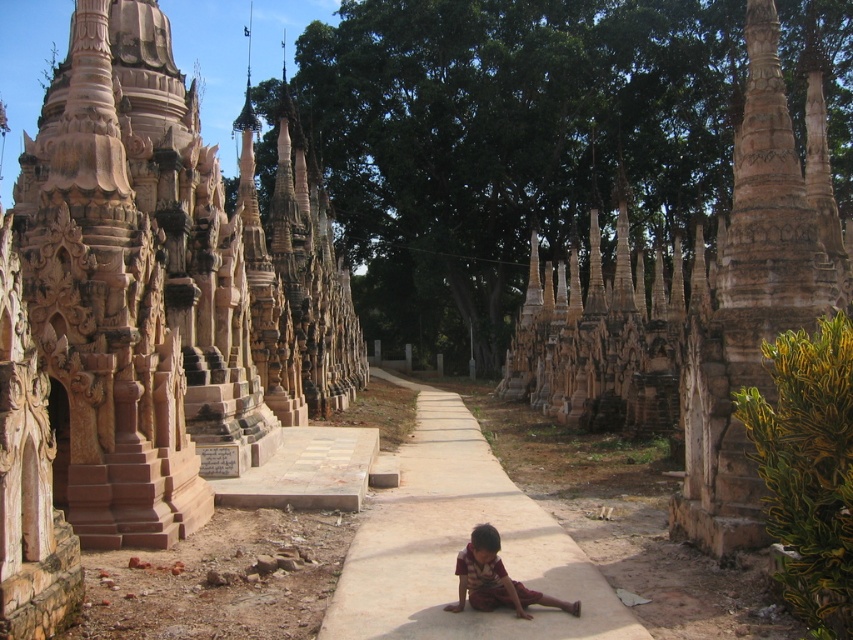
Is brown stone temple at center shorter than sandy concrete path at center?

No, brown stone temple at center is not shorter than sandy concrete path at center.

Who is shorter, brown stone temple at center or sandy concrete path at center?

Standing shorter between the two is sandy concrete path at center.

Between point (94, 195) and point (347, 577), which one is positioned in front?

Positioned in front is point (347, 577).

Image resolution: width=853 pixels, height=640 pixels. Find the location of `brown stone temple at center`. brown stone temple at center is located at coordinates (146, 314).

Between smooth stone pillar at center and sandy concrete path at center, which one appears on the left side from the viewer's perspective?

From the viewer's perspective, sandy concrete path at center appears more on the left side.

Which is above, smooth stone pillar at center or sandy concrete path at center?

smooth stone pillar at center is above.

Is point (689, 362) behind point (451, 508)?

No, it is not.

Locate an element on the screen. smooth stone pillar at center is located at coordinates point(755,289).

Who is more distant from viewer, (88,333) or (560,605)?

Point (88,333)

Can you confirm if brown stone temple at center is positioned to the left of brown fabric pants at center?

Indeed, brown stone temple at center is positioned on the left side of brown fabric pants at center.

Based on the photo, who is more forward, [3,296] or [497,532]?

Point [3,296] is in front.

You are a GUI agent. You are given a task and a screenshot of the screen. Output one action in this format:
    pyautogui.click(x=<x>, y=<y>)
    Task: Click on the brown stone temple at center
    This screenshot has width=853, height=640.
    Given the screenshot: What is the action you would take?
    (146, 314)